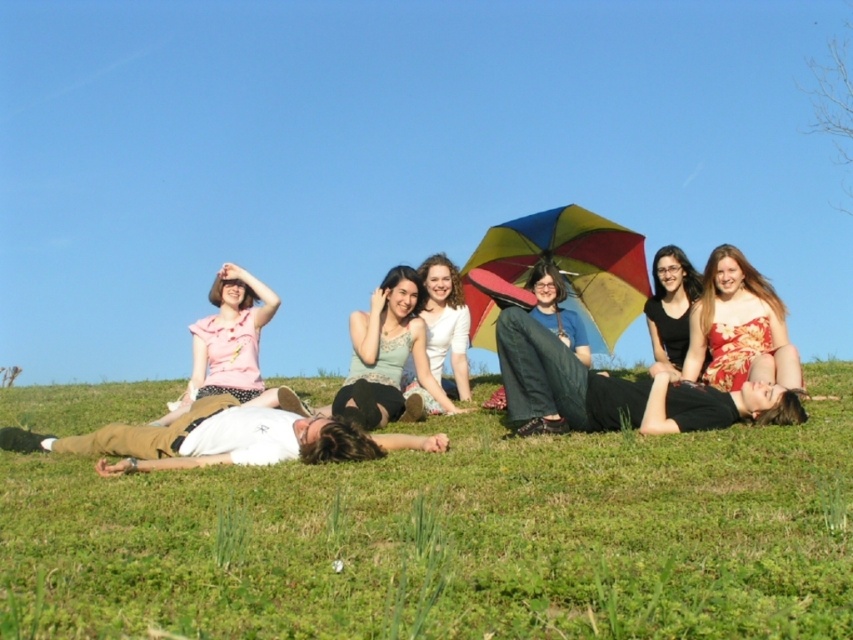
Does green grass at lower center have a smaller size compared to matte pink blouse at left?

Correct, green grass at lower center occupies less space than matte pink blouse at left.

What do you see at coordinates (451, 538) in the screenshot? I see `green grass at lower center` at bounding box center [451, 538].

The height and width of the screenshot is (640, 853). I want to click on green grass at lower center, so click(451, 538).

What do you see at coordinates (451, 538) in the screenshot? Image resolution: width=853 pixels, height=640 pixels. I see `green grass at lower center` at bounding box center [451, 538].

Consider the image. Is green grass at lower center closer to the viewer compared to matte green dress at center?

Yes, green grass at lower center is closer to the viewer.

Is point (466, 420) positioned behind point (344, 406)?

Yes, point (466, 420) is farther from viewer.

Locate an element on the screen. green grass at lower center is located at coordinates (451, 538).

Between point (354, 310) and point (247, 312), which one is positioned behind?

The point (354, 310) is behind.

Is point (379, 413) positioned before point (225, 300)?

That is True.

In order to click on matte green dress at center in this screenshot , I will do pos(387,353).